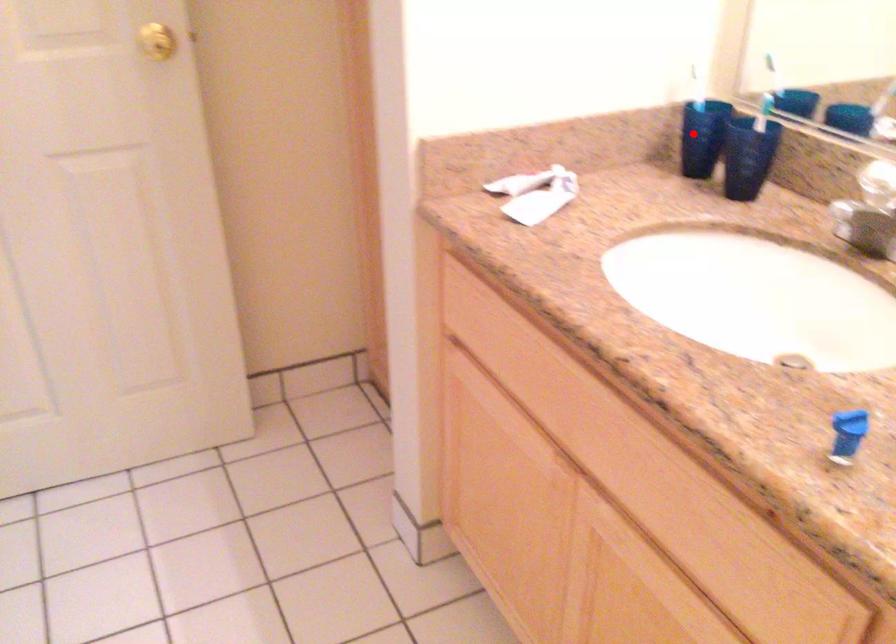
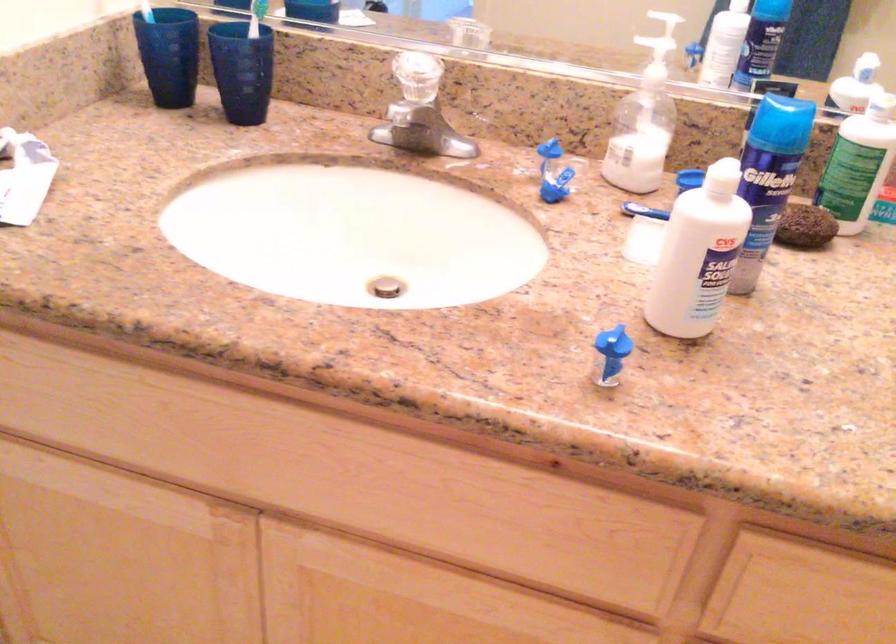
Question: I am providing you with two images of the same scene from different viewpoints. Image1 has a red point marked. In image2, the corresponding 3D location appears at what relative position? Reply with the corresponding letter.

Choices:
 (A) Closer
 (B) Farther

Answer: (A)